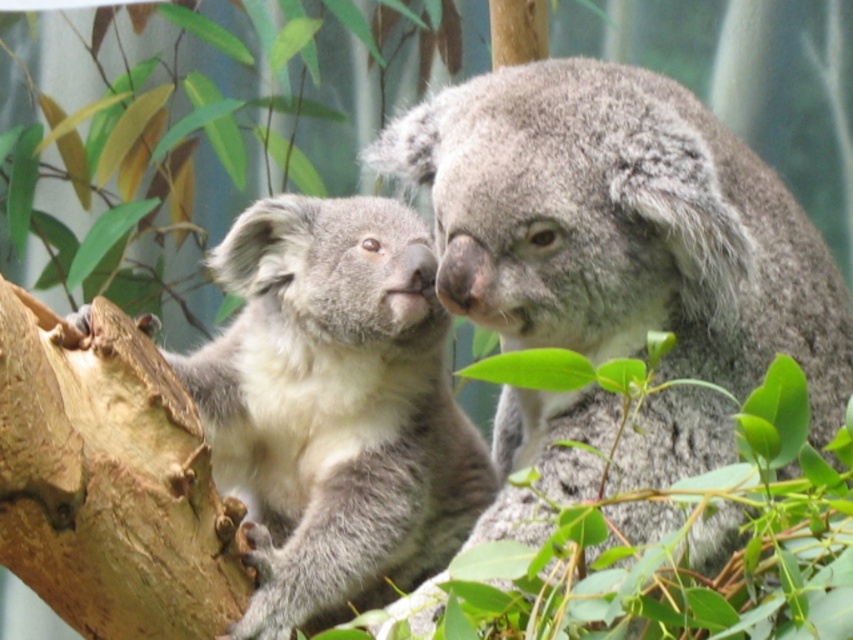
Question: Can you confirm if gray fluffy koala at center is wider than gray furry koala at left?

Choices:
 (A) no
 (B) yes

Answer: (B)

Question: Can you confirm if gray fluffy koala at center is smaller than gray furry koala at left?

Choices:
 (A) no
 (B) yes

Answer: (A)

Question: Which of the following is the closest to the observer?

Choices:
 (A) gray furry koala at left
 (B) gray fluffy koala at center

Answer: (B)

Question: Does gray fluffy koala at center appear under gray furry koala at left?

Choices:
 (A) no
 (B) yes

Answer: (A)

Question: Among these points, which one is nearest to the camera?

Choices:
 (A) (306, 275)
 (B) (492, 288)

Answer: (B)